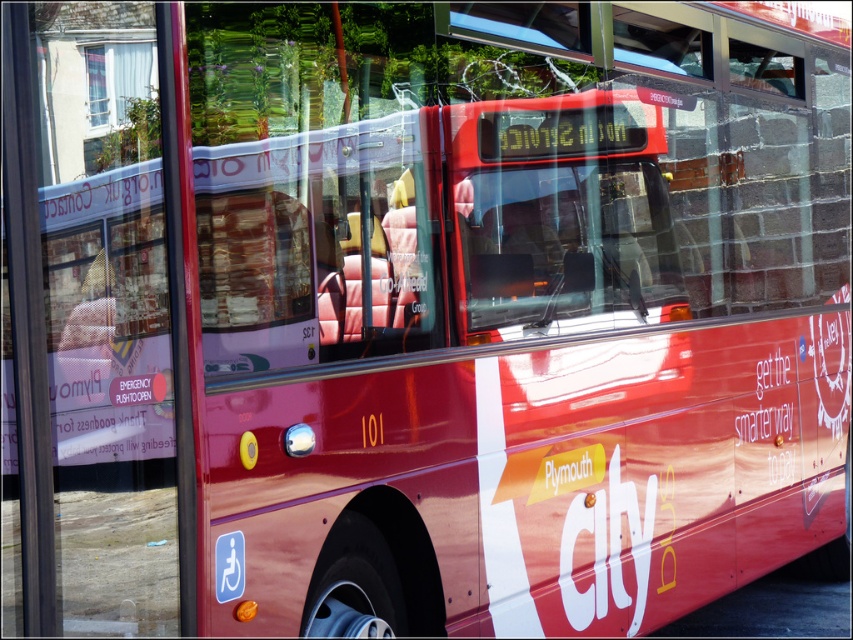
You are standing at the point marked with coordinates (103, 314). What object is exactly at this location?

The glossy red bus at center is located at point (103, 314).

You are standing in front of the red Plymouth Citybus and want to take a photo. You notice two points on the bus, one at point (x=26, y=189) and another at point (x=102, y=88). Which point will appear larger in your photo?

Point (x=26, y=189) will appear larger in the photo because it is closer to the camera than point (x=102, y=88).

You are standing 5 meters away from the red Plymouth Citybus vehicle. You want to reach the transparent glass window at upper center. Is the distance within your reach?

The transparent glass window at upper center is 4.59 meters away from the viewer, so yes, the distance is within reach since it is less than 5 meters.